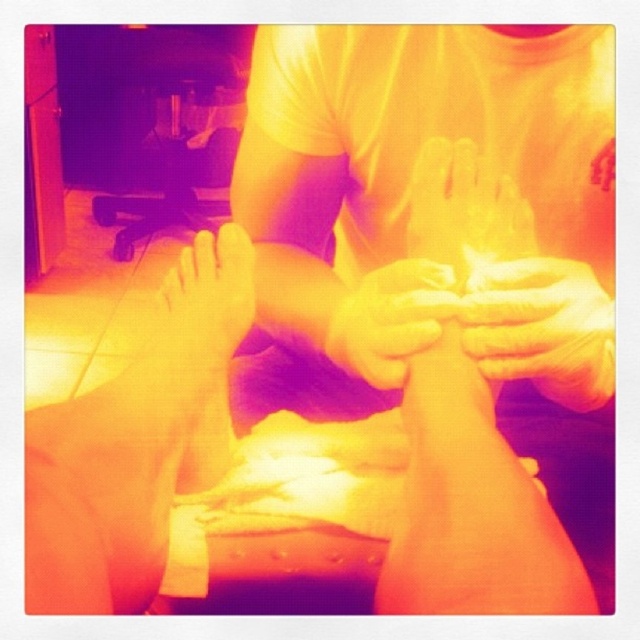
Question: Which of the following is the farthest from the observer?

Choices:
 (A) (442, 161)
 (B) (496, 326)
 (C) (358, 369)

Answer: (C)

Question: Does white rubber glove at center lie behind smooth white hands at center?

Choices:
 (A) no
 (B) yes

Answer: (B)

Question: Which point is farther from the camera taking this photo?

Choices:
 (A) (378, 385)
 (B) (513, 224)
 (C) (477, 300)

Answer: (B)

Question: Does smooth white hand at center come in front of smooth white hands at center?

Choices:
 (A) yes
 (B) no

Answer: (B)

Question: Among these objects, which one is farthest from the camera?

Choices:
 (A) white rubber glove at center
 (B) smooth white hand at center
 (C) smooth white hands at center

Answer: (B)

Question: Does smooth white hand at center appear on the left side of smooth white hands at center?

Choices:
 (A) yes
 (B) no

Answer: (B)